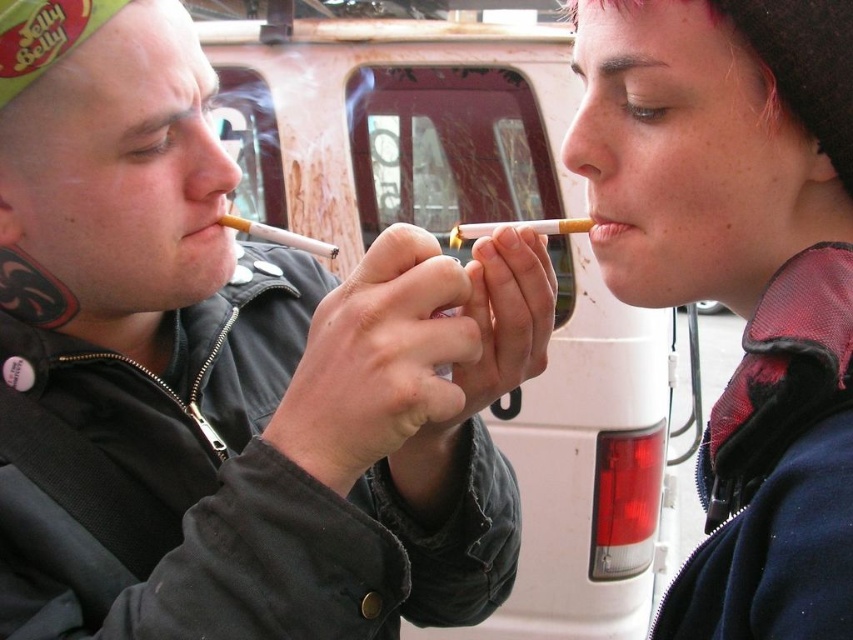
Between white matte cigarette at center and matte pink lipstick at mouth, which one is positioned higher?

white matte cigarette at center

The image size is (853, 640). Find the location of `white matte cigarette at center`. white matte cigarette at center is located at coordinates (520, 227).

Between point (268, 621) and point (775, 538), which one is positioned behind?

Positioned behind is point (268, 621).

Is matte black jacket at center smaller than matte black jacket at upper right?

No.

Is point (68, 109) positioned after point (770, 72)?

Yes, it is.

This screenshot has width=853, height=640. In order to click on matte black jacket at center in this screenshot , I will do `click(228, 372)`.

Which of these two, matte black jacket at center or matte white cigarette at center, stands taller?

Standing taller between the two is matte black jacket at center.

From the picture: Which is below, matte black jacket at center or matte white cigarette at center?

Positioned lower is matte black jacket at center.

Image resolution: width=853 pixels, height=640 pixels. Find the location of `matte black jacket at center`. matte black jacket at center is located at coordinates (228, 372).

The width and height of the screenshot is (853, 640). Identify the location of matte black jacket at center. (228, 372).